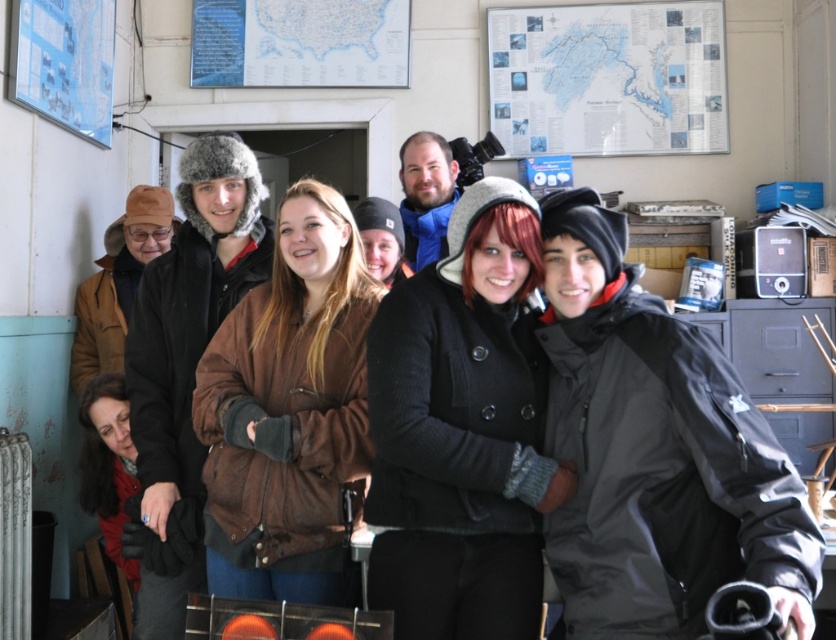
Question: From the image, what is the correct spatial relationship of black matte jacket at center in relation to black wool coat at center?

Choices:
 (A) right
 (B) left

Answer: (A)

Question: Is brown suede jacket at center in front of white paper map at upper right?

Choices:
 (A) yes
 (B) no

Answer: (A)

Question: Which object appears farthest from the camera in this image?

Choices:
 (A) brown suede jacket at center
 (B) black matte jacket at center
 (C) black wool coat at center

Answer: (A)

Question: Which object appears farthest from the camera in this image?

Choices:
 (A) brown suede jacket at center
 (B) white paper map at upper right

Answer: (B)

Question: Does brown fuzzy hat at left have a larger size compared to white paper map at upper right?

Choices:
 (A) yes
 (B) no

Answer: (A)

Question: Which point is closer to the camera?

Choices:
 (A) (600, 440)
 (B) (245, 209)
 (C) (472, 339)
 (D) (228, 484)

Answer: (A)